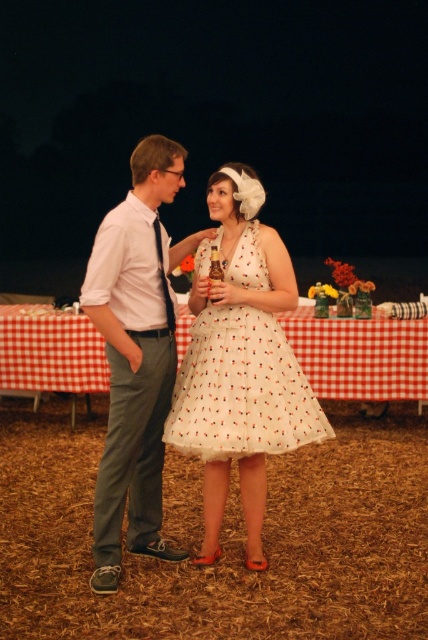
Question: Which of the following is the farthest from the observer?

Choices:
 (A) light gray cotton pants at left
 (B) white lace dress at center

Answer: (B)

Question: Estimate the real-world distances between objects in this image. Which object is closer to the white checkered tablecloth at center?

Choices:
 (A) white lace dress at center
 (B) light gray cotton pants at left

Answer: (B)

Question: Can you confirm if white lace dress at center is positioned below white checkered tablecloth at center?

Choices:
 (A) yes
 (B) no

Answer: (B)

Question: Does light gray cotton pants at left come behind white checkered tablecloth at center?

Choices:
 (A) yes
 (B) no

Answer: (B)

Question: Does light gray cotton pants at left have a greater width compared to white lace dress at center?

Choices:
 (A) yes
 (B) no

Answer: (B)

Question: Which of these objects is positioned farthest from the white lace dress at center?

Choices:
 (A) white checkered tablecloth at center
 (B) light gray cotton pants at left

Answer: (A)